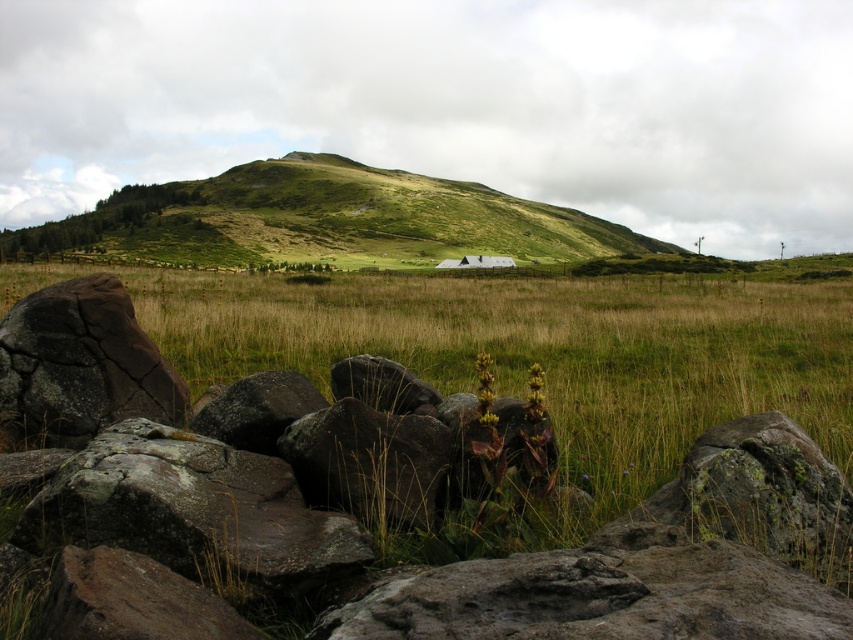
Which of these two, green grassy hillside at upper center or dark brown cracked rock at lower left, stands shorter?

dark brown cracked rock at lower left is shorter.

Can you confirm if green grassy hillside at upper center is positioned to the right of dark brown cracked rock at lower left?

No, green grassy hillside at upper center is not to the right of dark brown cracked rock at lower left.

Is point (547, 218) positioned in front of point (54, 344)?

No, it is behind (54, 344).

Identify the location of green grassy hillside at upper center. (325, 220).

Does dark brown cracked rock at lower left have a smaller size compared to rusty metallic boulder at center?

Actually, dark brown cracked rock at lower left might be larger than rusty metallic boulder at center.

Consider the image. Who is more forward, (97, 394) or (389, 380)?

Point (97, 394) is more forward.

The height and width of the screenshot is (640, 853). What are the coordinates of `dark brown cracked rock at lower left` in the screenshot? It's located at (80, 364).

Does green grassy hillside at upper center appear on the right side of rusty stone boulder at lower left?

No, green grassy hillside at upper center is not to the right of rusty stone boulder at lower left.

Does green grassy hillside at upper center appear over rusty stone boulder at lower left?

Yes, green grassy hillside at upper center is above rusty stone boulder at lower left.

Which is in front, point (518, 220) or point (222, 512)?

Point (222, 512) is in front.

The height and width of the screenshot is (640, 853). In order to click on green grassy hillside at upper center in this screenshot , I will do `click(325, 220)`.